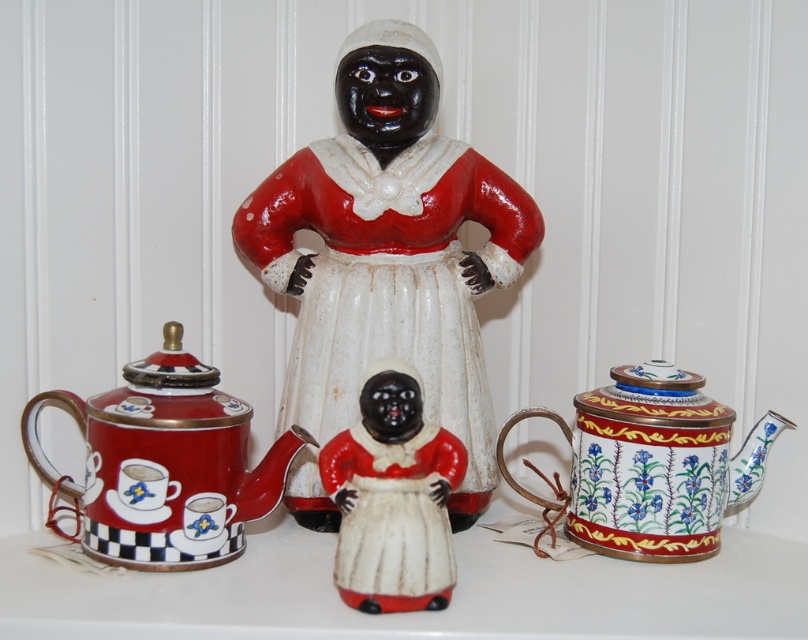
You are arranging items on a shelf and want to place the matte ceramic figure at center and the matte red teapot at left. Based on their positions in the image, which item is placed higher up?

The matte ceramic figure at center is positioned over the matte red teapot at left, so it is placed higher up.

You are arranging items on a shelf and have the matte ceramic figure at center and the matte red teapot at left. If you want to place them side by side without overlapping, which item should you place on the left to accommodate their widths?

The matte ceramic figure at center is wider than the matte red teapot at left, so you should place the matte ceramic figure at center on the left to accommodate their widths.

You are arranging a display of vintage items and need to place the enamel floral teapot at right and the matte porcelain doll at center. According to the scene, which object is located to the right of the other?

The enamel floral teapot at right is positioned on the right side of the matte porcelain doll at center, so the teapot is to the right of the doll.